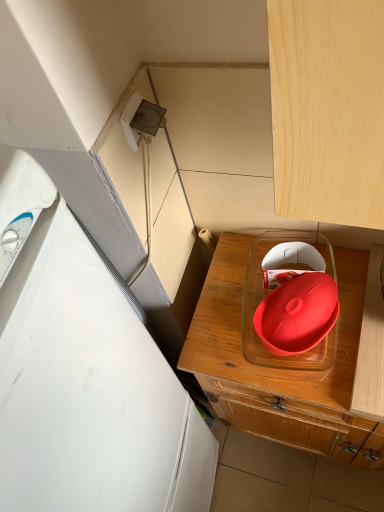
Locate an element on the screen. This screenshot has width=384, height=512. empty space that is ontop of matte plastic tray at center (from a real-world perspective) is located at coordinates pyautogui.click(x=311, y=339).